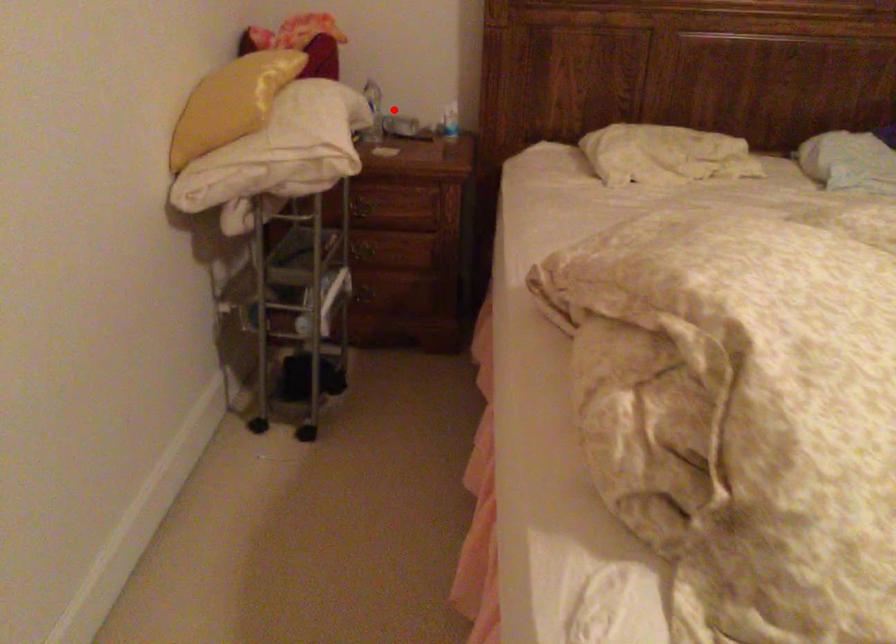
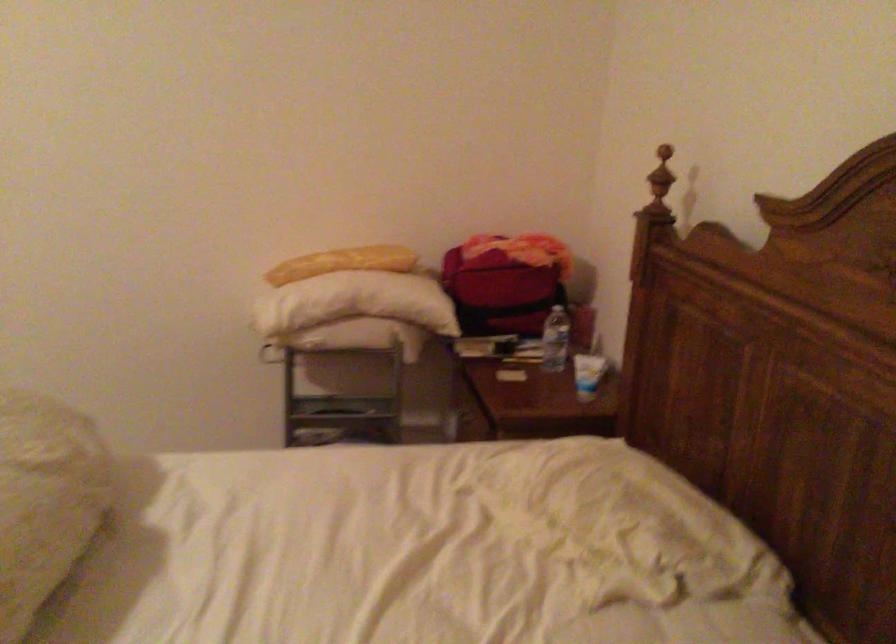
Where in the second image is the point corresponding to the highlighted location from the first image?

(556, 339)